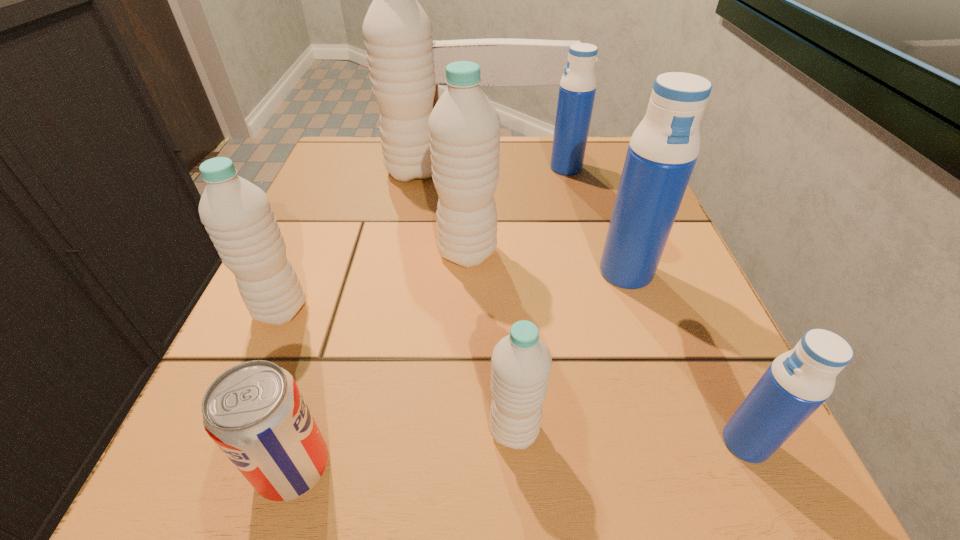
I want to click on the second water bottle from left to right, so click(x=397, y=31).

Identify the location of the second white water bottle from left to right. (397, 31).

Image resolution: width=960 pixels, height=540 pixels. In order to click on the third nearest white water bottle in this screenshot , I will do `click(464, 127)`.

Locate an element on the screen. the biggest blue water bottle is located at coordinates (663, 150).

This screenshot has height=540, width=960. What are the coordinates of `the farthest blue water bottle` in the screenshot? It's located at tap(577, 89).

Where is `the leftmost water bottle`? This screenshot has height=540, width=960. the leftmost water bottle is located at coordinates (237, 215).

This screenshot has height=540, width=960. What are the coordinates of `the leftmost object` in the screenshot? It's located at (237, 215).

Find the location of a particular element. This screenshot has width=960, height=540. the nearest white water bottle is located at coordinates (521, 364).

Where is `the smallest blue water bottle`? the smallest blue water bottle is located at coordinates (799, 381).

This screenshot has width=960, height=540. I want to click on the rightmost water bottle, so click(x=799, y=381).